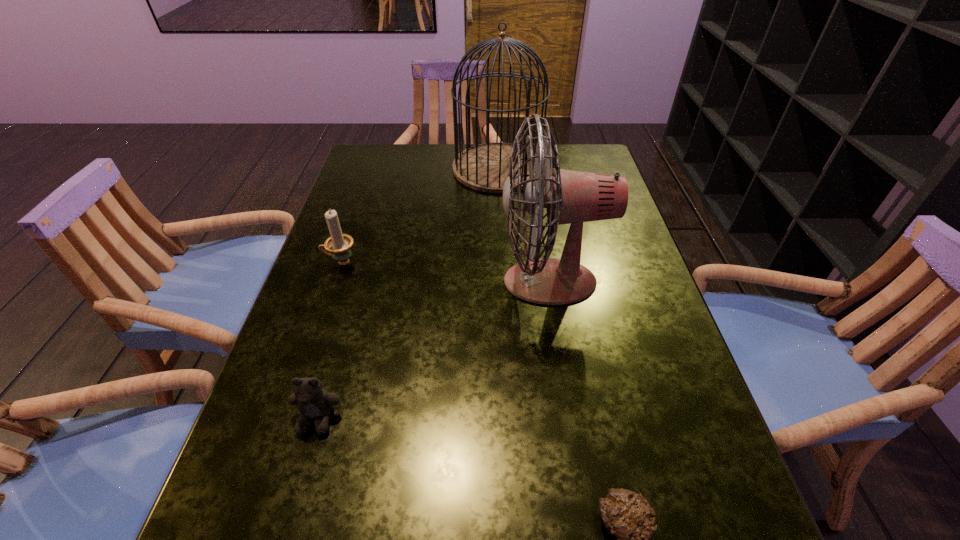
You are a GUI agent. You are given a task and a screenshot of the screen. Output one action in this format:
    pyautogui.click(x=<x>, y=<y>)
    Task: Click on the blank space located in front of the fan to direct airflow
    
    Given the screenshot: What is the action you would take?
    pyautogui.click(x=350, y=281)

Find the location of a particular element. free space located 0.110m on the face of the teddy bear is located at coordinates (292, 508).

You are a GUI agent. You are given a task and a screenshot of the screen. Output one action in this format:
    pyautogui.click(x=<x>, y=<y>)
    Task: Click on the object that is at the far edge
    This screenshot has width=960, height=540.
    Given the screenshot: What is the action you would take?
    pyautogui.click(x=484, y=167)

Find the location of a particular element. This screenshot has width=960, height=540. candle_holder at the left edge is located at coordinates (339, 244).

This screenshot has height=540, width=960. I want to click on teddy bear located in the left edge section of the desktop, so click(314, 403).

Find the location of `object that is positioned at the right edge`. object that is positioned at the right edge is located at coordinates pyautogui.click(x=570, y=197).

Find the location of `free region at the far edge of the desktop`. free region at the far edge of the desktop is located at coordinates (433, 155).

In the image, there is a desktop. At what (x,y) coordinates should I click in order to perform the action: click on vacant space at the left edge. Please return your answer as a coordinate pair (x, y). Looking at the image, I should click on (346, 274).

This screenshot has width=960, height=540. Identify the location of vacant space at the right edge of the desktop. tap(603, 286).

Locate an element on the screen. The image size is (960, 540). free spot at the far right corner of the desktop is located at coordinates (566, 164).